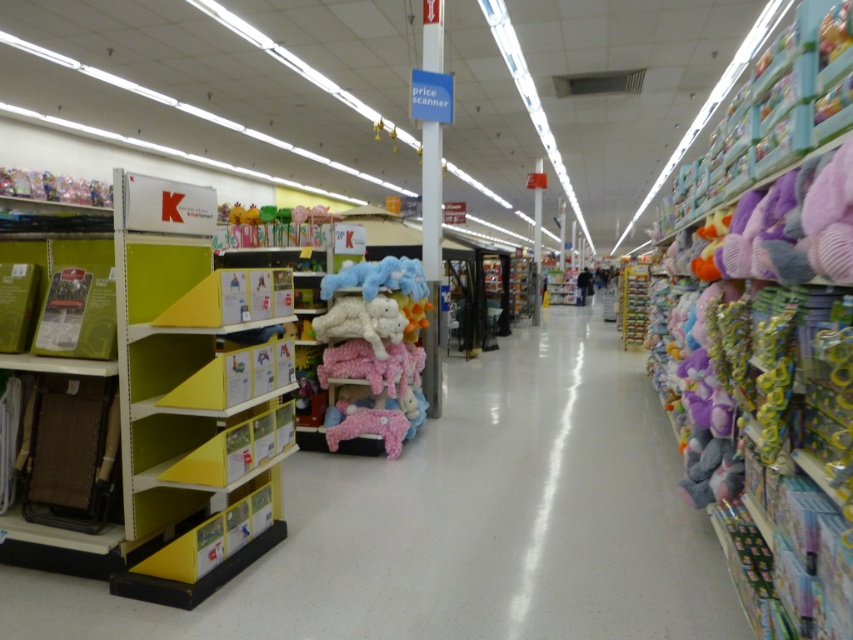
You are standing in the retail store aisle and want to reach both the point at coordinates [532,312] and the point at coordinates [579,282]. Which point will you reach first?

You will reach the point at coordinates [532,312] first because it is closer to you than the point at coordinates [579,282].

You are a delivery person who needs to move a large box from the pastel plush toys at center to the dark blue jacket at center. The box is 80 feet long. Can you move it without bending or rotating the box?

The distance between the pastel plush toys at center and the dark blue jacket at center is 78.30 feet. Since the box is 80 feet long, which is longer than the available space, you cannot move it without bending or rotating the box.

You are a customer in the store and want to grab both the pastel plush toys at center and the dark blue jacket at center. Which item should you reach for first if you want to pick up the one closer to your current position?

The pastel plush toys at center are to the left of the dark blue jacket at center, so if you are standing in the aisle, you would reach for the pastel plush toys at center first as they are closer to your left side.